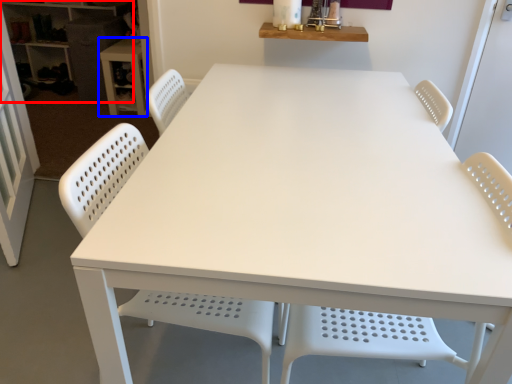
Question: Among these objects, which one is nearest to the camera, shelf (highlighted by a red box) or table (highlighted by a blue box)?

Choices:
 (A) shelf
 (B) table

Answer: (B)